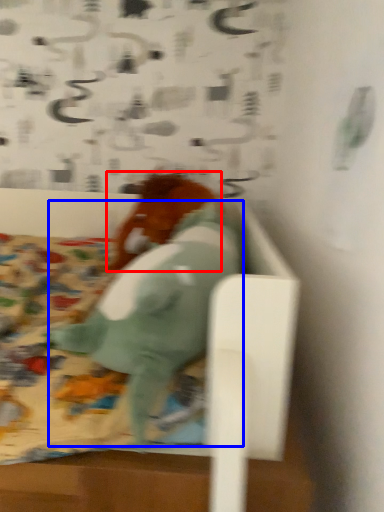
Question: Which of the following is the farthest to the observer, animal (highlighted by a red box) or animal (highlighted by a blue box)?

Choices:
 (A) animal
 (B) animal

Answer: (A)